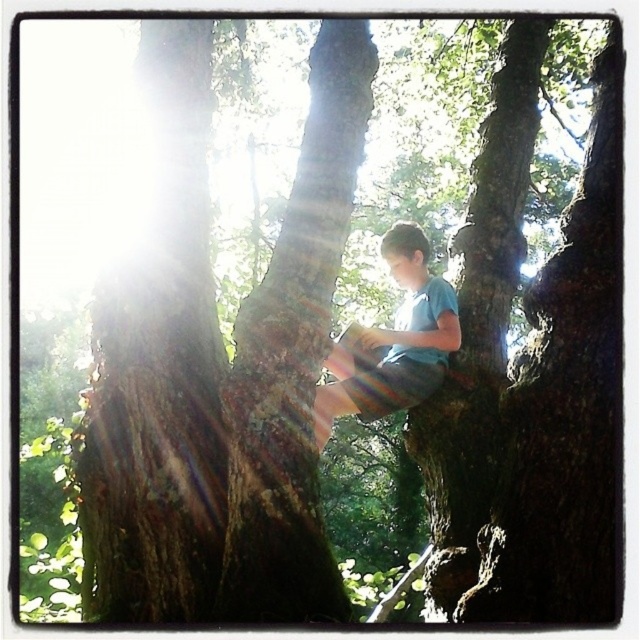
Is smooth brown bark at left taller than light blue striped shorts at center?

Yes.

Identify the location of smooth brown bark at left. Image resolution: width=640 pixels, height=640 pixels. (160, 369).

Does point (141, 310) lie in front of point (406, 260)?

Yes, it is in front of point (406, 260).

This screenshot has height=640, width=640. Find the location of `smooth brown bark at left`. smooth brown bark at left is located at coordinates (160, 369).

Can you confirm if brown rough bark at center is positioned to the right of light blue striped shorts at center?

No, brown rough bark at center is not to the right of light blue striped shorts at center.

Who is positioned more to the left, brown rough bark at center or light blue striped shorts at center?

brown rough bark at center

The height and width of the screenshot is (640, 640). Describe the element at coordinates (292, 358) in the screenshot. I see `brown rough bark at center` at that location.

Image resolution: width=640 pixels, height=640 pixels. In order to click on brown rough bark at center in this screenshot , I will do `click(292, 358)`.

Is point (200, 550) closer to viewer compared to point (285, 227)?

Yes, point (200, 550) is closer to viewer.

Can you confirm if smooth brown bark at left is bigger than brown rough bark at center?

Correct, smooth brown bark at left is larger in size than brown rough bark at center.

Locate an element on the screen. The width and height of the screenshot is (640, 640). smooth brown bark at left is located at coordinates (160, 369).

This screenshot has width=640, height=640. I want to click on smooth brown bark at left, so click(x=160, y=369).